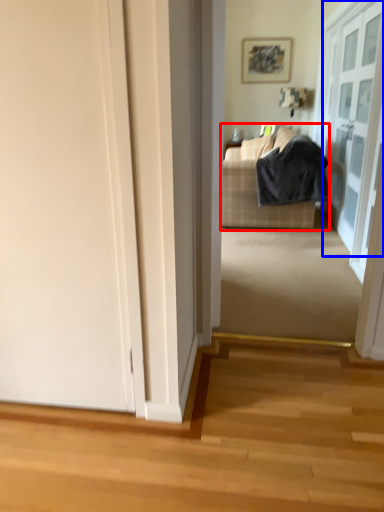
Question: Which of the following is the closest to the observer, studio couch (highlighted by a red box) or door (highlighted by a blue box)?

Choices:
 (A) studio couch
 (B) door

Answer: (B)